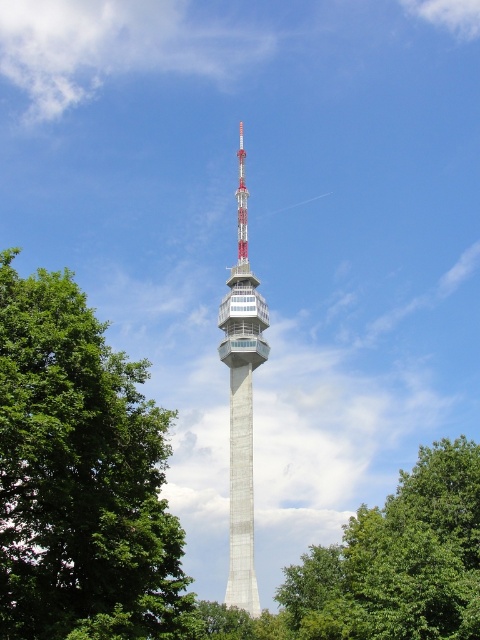
Question: Which object is farther from the camera taking this photo?

Choices:
 (A) concrete tower at center
 (B) green leafy tree at center
 (C) green leafy tree at left

Answer: (A)

Question: Observing the image, what is the correct spatial positioning of green leafy tree at center in reference to concrete tower at center?

Choices:
 (A) below
 (B) above

Answer: (A)

Question: Among these points, which one is farthest from the camera?

Choices:
 (A) (239, 522)
 (B) (429, 520)

Answer: (A)

Question: Among these objects, which one is farthest from the camera?

Choices:
 (A) green leafy tree at center
 (B) concrete tower at center

Answer: (B)

Question: In this image, where is green leafy tree at left located relative to concrete tower at center?

Choices:
 (A) below
 (B) above

Answer: (A)

Question: Does green leafy tree at center appear over concrete tower at center?

Choices:
 (A) yes
 (B) no

Answer: (B)